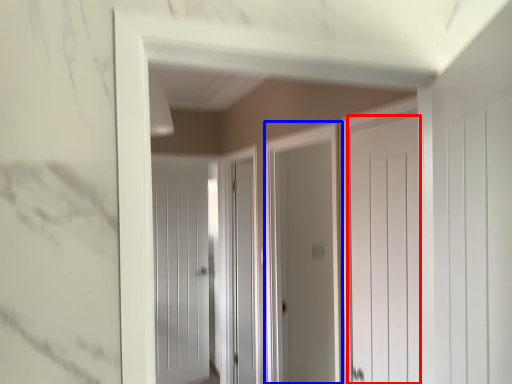
Question: Which object appears closest to the camera in this image, door (highlighted by a red box) or screen door (highlighted by a blue box)?

Choices:
 (A) door
 (B) screen door

Answer: (A)